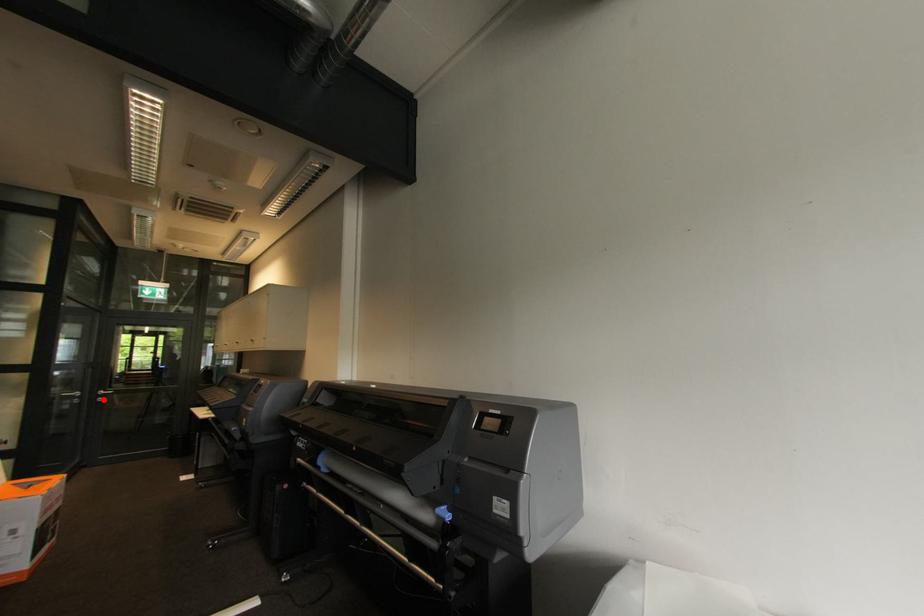
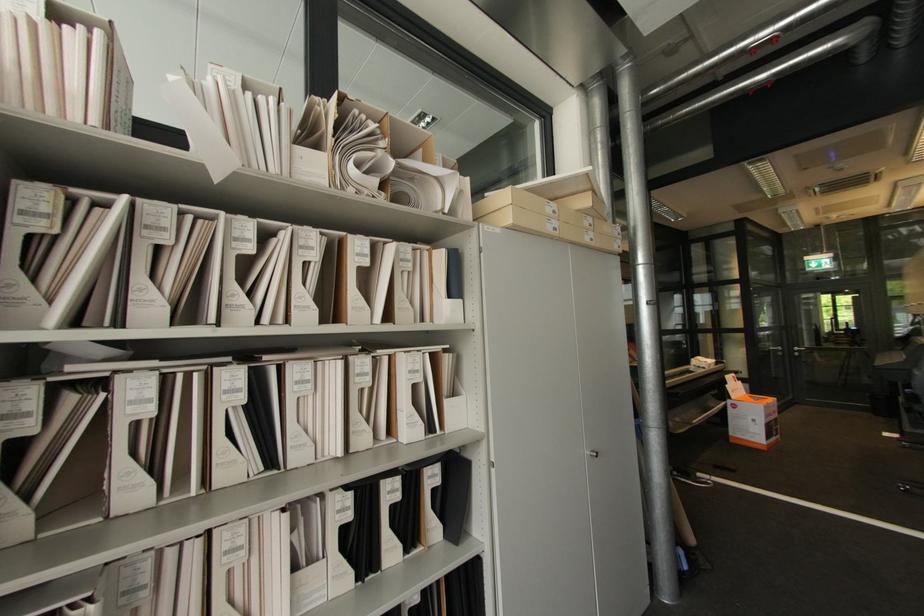
Locate, in the second image, the point that corresponds to the highlighted location in the first image.

(800, 354)